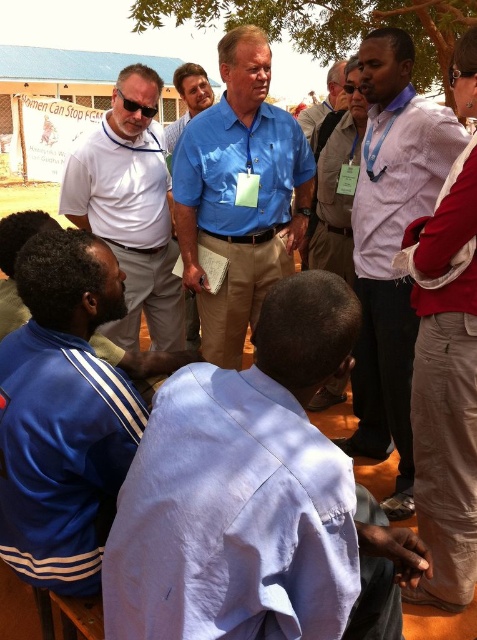
You are part of the group and want to greet the person wearing the white shirt at center. Since you are facing the sunglasses at upper center, which direction should you turn to approach them?

The white shirt at center is to the right of sunglasses at upper center, so you should turn to your right to approach them.

You are part of the group and want to hand a document to the person wearing the white shirt at center. To do so, should you look up or down from the sunglasses at upper center?

The white shirt at center is located below the sunglasses at upper center, so you should look down from the sunglasses at upper center to hand the document.

You are part of the group in the image and need to hand a document to both the person wearing the blue fabric jacket at lower left and the person in the white matte shirt at center. Based on their positions, which person is closer to the left side of the group?

The blue fabric jacket at lower left is to the right of the white matte shirt at center, so the white matte shirt at center is closer to the left side of the group.